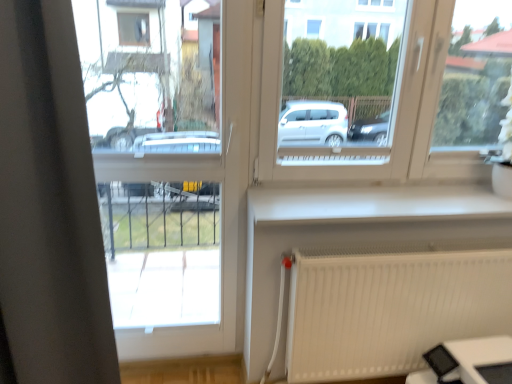
Question: Should I look upward or downward to see white smooth window sill at center?

Choices:
 (A) down
 (B) up

Answer: (A)

Question: Is the position of white plastic window frame at left less distant than that of white smooth window sill at center?

Choices:
 (A) no
 (B) yes

Answer: (B)

Question: Can you confirm if white plastic window frame at left is wider than white smooth window sill at center?

Choices:
 (A) yes
 (B) no

Answer: (B)

Question: Considering the relative sizes of white plastic window frame at left and white smooth window sill at center in the image provided, is white plastic window frame at left smaller than white smooth window sill at center?

Choices:
 (A) yes
 (B) no

Answer: (B)

Question: From the image's perspective, is white plastic window frame at left beneath white smooth window sill at center?

Choices:
 (A) yes
 (B) no

Answer: (A)

Question: Is white plastic window frame at left next to white smooth window sill at center?

Choices:
 (A) no
 (B) yes

Answer: (A)

Question: Is white plastic window frame at left positioned with its back to white smooth window sill at center?

Choices:
 (A) yes
 (B) no

Answer: (B)

Question: Is white smooth window sill at center positioned in front of white plastic window at center?

Choices:
 (A) yes
 (B) no

Answer: (B)

Question: Does white smooth window sill at center have a lesser height compared to white plastic window at center?

Choices:
 (A) yes
 (B) no

Answer: (A)

Question: Can you confirm if white smooth window sill at center is smaller than white plastic window at center?

Choices:
 (A) no
 (B) yes

Answer: (B)

Question: From the image's perspective, is white smooth window sill at center located beneath white plastic window at center?

Choices:
 (A) no
 (B) yes

Answer: (B)

Question: From a real-world perspective, is white smooth window sill at center positioned under white plastic window at center based on gravity?

Choices:
 (A) no
 (B) yes

Answer: (B)

Question: Can you confirm if white smooth window sill at center is bigger than white plastic window at center?

Choices:
 (A) yes
 (B) no

Answer: (B)

Question: Considering the relative sizes of white smooth window sill at center and white plastic window frame at left in the image provided, is white smooth window sill at center bigger than white plastic window frame at left?

Choices:
 (A) yes
 (B) no

Answer: (B)